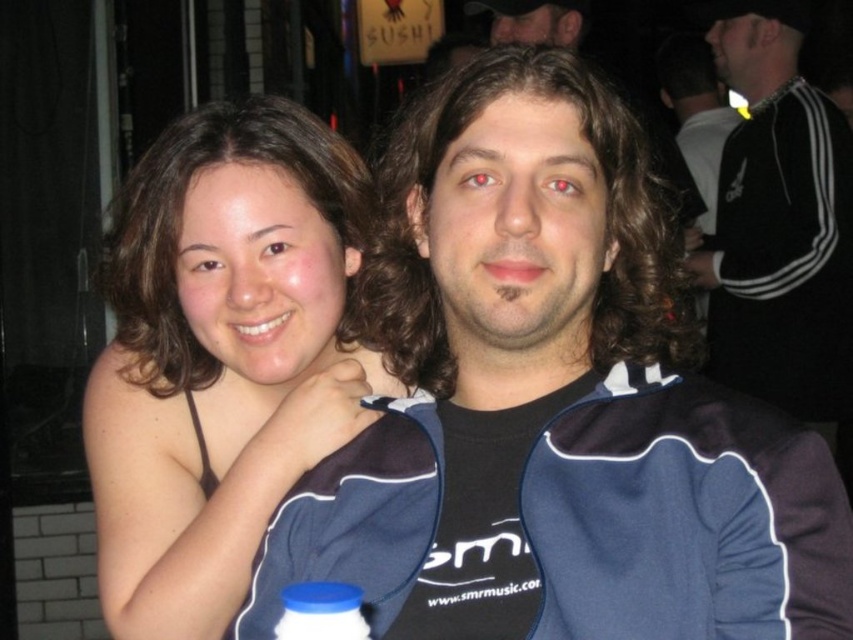
You are organizing a photo shoot and need to ensure that the blue plastic bottle at lower center and the matte black hair at upper center are both visible in the frame. Based on their sizes, which object should you prioritize positioning closer to the camera to maintain clarity?

The blue plastic bottle at lower center should be positioned closer to the camera because it occupies less space and may appear smaller in the frame compared to the matte black hair at upper center.

You are at a social event and see the blue plastic bottle at lower center. If you want to place it exactly at point 0.956, 0.377, where would you put it?

The blue plastic bottle at lower center is already located at point (321, 611).

You are a photographer at the event and need to adjust the lighting to ensure both the black adidas tracksuit at right and the matte black hair at upper center are well lit. Considering their widths, which object requires a wider light beam to cover its entire width?

The black adidas tracksuit at right requires a wider light beam because its width surpasses that of the matte black hair at upper center.